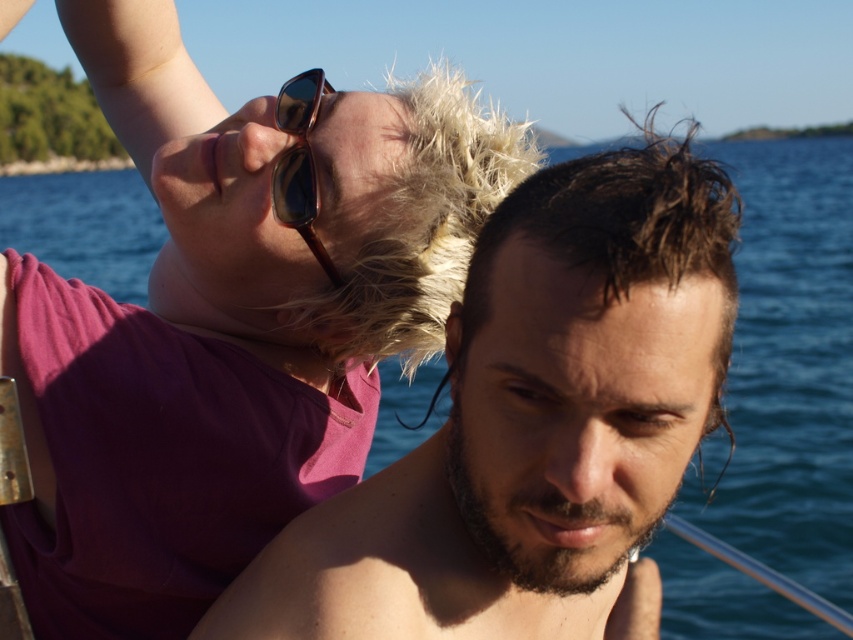
You are a photographer trying to capture the scene from the boat. You notice the matte pink shirt at upper left and the shiny brown sunglasses at upper center. Which object should you focus on to ensure it takes up more space in your photo?

The matte pink shirt at upper left is larger in size than the shiny brown sunglasses at upper center, so focusing on the matte pink shirt at upper left will ensure it takes up more space in the photo.

You are a photographer on the boat and want to capture a clear shot of both the dark brown wet hair at center and the shiny brown sunglasses at upper center. Which object should you focus on first to ensure both are in focus?

You should focus on the dark brown wet hair at center first because it is closer to the viewer than the shiny brown sunglasses at upper center. By focusing on the closer object, the sunglasses will also be in focus due to the depth of field.

You are a photographer trying to capture a closeup of the shiny brown sunglasses at upper center without including the matte pink shirt at upper left in the frame. Based on their positions, is this possible?

The matte pink shirt at upper left is located below the shiny brown sunglasses at upper center, so if you position the camera to focus on the sunglasses while avoiding the area below them, it should be possible to exclude the shirt from the frame.